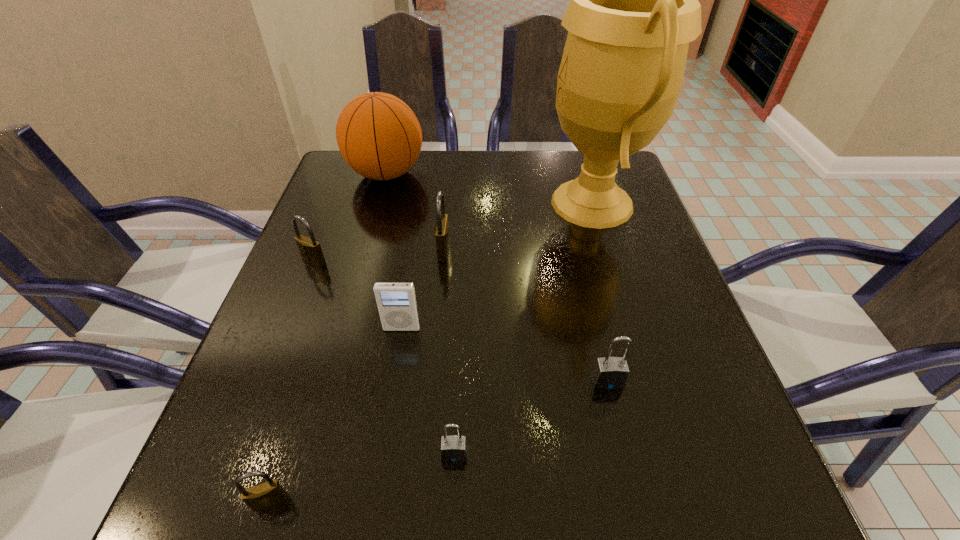
Locate an element on the screen. This screenshot has width=960, height=540. the second padlock from right to left is located at coordinates (453, 448).

Where is `the second nearest object`? This screenshot has height=540, width=960. the second nearest object is located at coordinates (453, 448).

I want to click on the nearest brass padlock, so click(x=264, y=495).

Locate an element on the screen. This screenshot has width=960, height=540. the second brass padlock from right to left is located at coordinates (264, 495).

The width and height of the screenshot is (960, 540). In order to click on vacant area situated 0.170m on the engravings side of the trophy in this screenshot , I will do `click(472, 203)`.

You are a GUI agent. You are given a task and a screenshot of the screen. Output one action in this format:
    pyautogui.click(x=<x>, y=<y>)
    Task: Click on the vacant space situated 0.100m on the engravings side of the trophy
    The image size is (960, 540).
    Given the screenshot: What is the action you would take?
    pyautogui.click(x=500, y=203)

What are the coordinates of `free spot located 0.160m on the engravings side of the trophy` in the screenshot? It's located at (476, 203).

The height and width of the screenshot is (540, 960). I want to click on vacant area situated 0.080m on the right of the seventh shortest object, so pyautogui.click(x=455, y=174).

You are a GUI agent. You are given a task and a screenshot of the screen. Output one action in this format:
    pyautogui.click(x=<x>, y=<y>)
    Task: Click on the free location located on the right of the third padlock from right to left
    
    Given the screenshot: What is the action you would take?
    pyautogui.click(x=495, y=251)

Identify the location of blank space located on the shackle of the third nearest padlock. (627, 463).